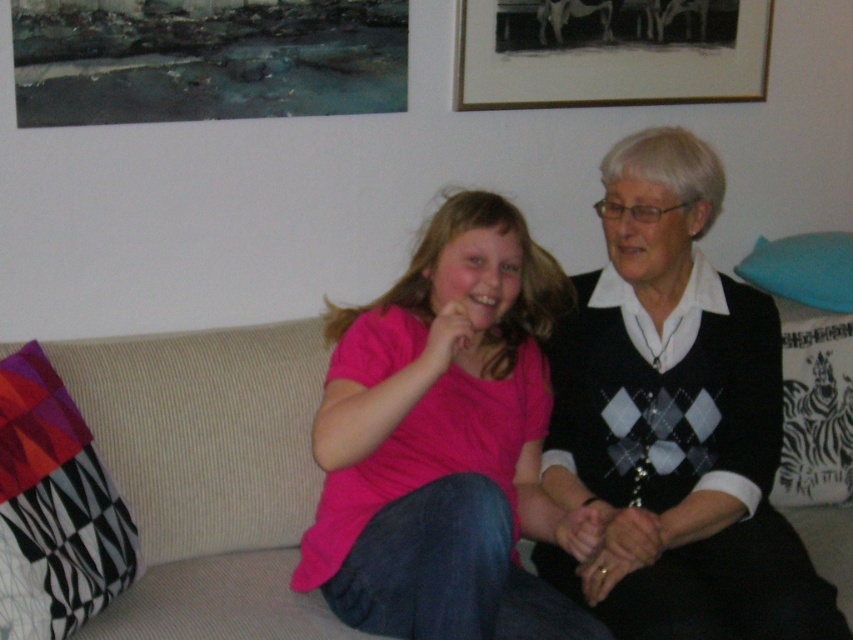
Question: Which object is farther from the camera taking this photo?

Choices:
 (A) black matte picture frame at upper center
 (B) black sweater at right
 (C) pink matte shirt at center

Answer: (A)

Question: Is black sweater at right below black matte picture frame at upper center?

Choices:
 (A) no
 (B) yes

Answer: (B)

Question: Which object is closer to the camera taking this photo?

Choices:
 (A) black matte picture frame at upper center
 (B) pink matte shirt at center
 (C) black sweater at right

Answer: (B)

Question: Which object is farther from the camera taking this photo?

Choices:
 (A) black matte picture frame at upper center
 (B) pink matte shirt at center

Answer: (A)

Question: Is black sweater at right positioned before pink matte shirt at center?

Choices:
 (A) no
 (B) yes

Answer: (A)

Question: In this image, where is black sweater at right located relative to black matte picture frame at upper center?

Choices:
 (A) above
 (B) below

Answer: (B)